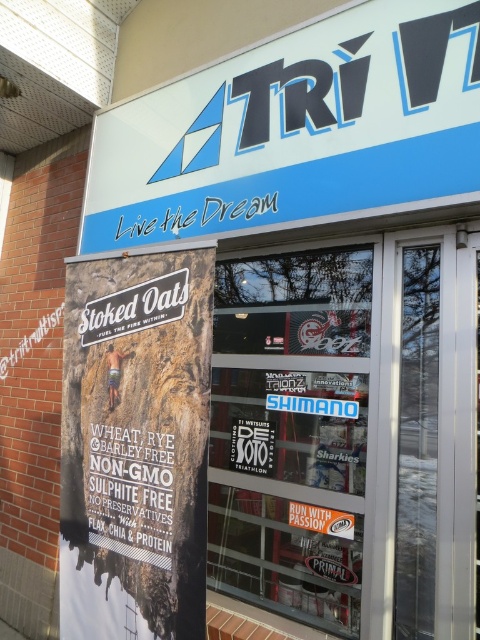
You are a customer standing in front of the Tri storefront. You notice two signs above the entrance. The blue plastic sign at upper center and the matte black sign at center. Which sign is taller?

The blue plastic sign at upper center is taller than the matte black sign at center.

You are a customer standing in front of the store entrance. You want to read the slogan displayed on the blue plastic sign at upper center. However, there is a matte paper poster at left blocking your view. Can you still see the slogan?

The blue plastic sign at upper center is bigger than the matte paper poster at left, so yes, you can still see the slogan on the blue plastic sign at upper center because it is larger and likely extends beyond the poster.

You are a customer standing in front of the Tri store entrance. You want to read the slogan on the blue plastic sign at upper center but are currently looking at the matte paper poster at left. Which direction should you move your head to see the slogan?

The blue plastic sign at upper center is to the right of the matte paper poster at left, so you should move your head to the right to see the slogan.